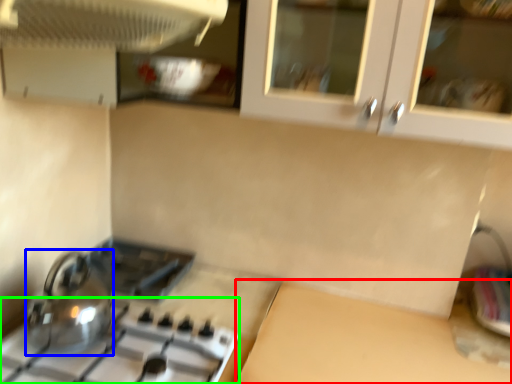
Question: Which object is the farthest from counter top (highlighted by a red box)? Choose among these: kitchen appliance (highlighted by a blue box) or gas stove (highlighted by a green box).

Choices:
 (A) kitchen appliance
 (B) gas stove

Answer: (A)